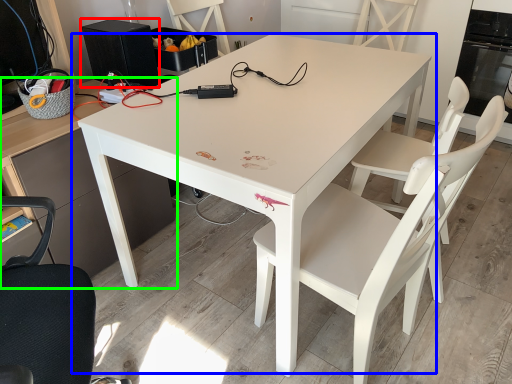
Question: Which is nearer to the appliance (highlighted by a red box)? table (highlighted by a blue box) or desk (highlighted by a green box).

Choices:
 (A) table
 (B) desk

Answer: (B)